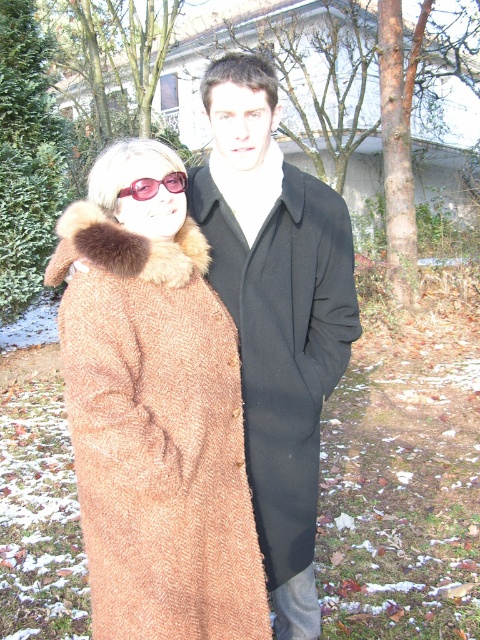
Can you confirm if black wool coat at center is positioned below translucent pink goggles at upper left?

Yes, black wool coat at center is below translucent pink goggles at upper left.

This screenshot has height=640, width=480. Identify the location of black wool coat at center. (283, 337).

Describe the element at coordinates (283, 337) in the screenshot. I see `black wool coat at center` at that location.

This screenshot has width=480, height=640. Identify the location of black wool coat at center. (283, 337).

Between point (242, 397) and point (190, 211), which one is positioned behind?

Point (190, 211)

Who is more forward, (323, 225) or (337, 227)?

Point (323, 225) is in front.

Between point (331, 248) and point (300, 451), which one is positioned behind?

The point (331, 248) is behind.

Locate an element on the screen. The image size is (480, 640). brown wool coat at center is located at coordinates (276, 314).

Is point (276, 465) positioned behind point (147, 198)?

Yes, it is.

Based on the photo, between brown wool coat at center and translucent pink goggles at upper left, which one has more height?

With more height is brown wool coat at center.

Is point (347, 285) farther from camera compared to point (177, 173)?

That is True.

Locate an element on the screen. The height and width of the screenshot is (640, 480). brown wool coat at center is located at coordinates (276, 314).